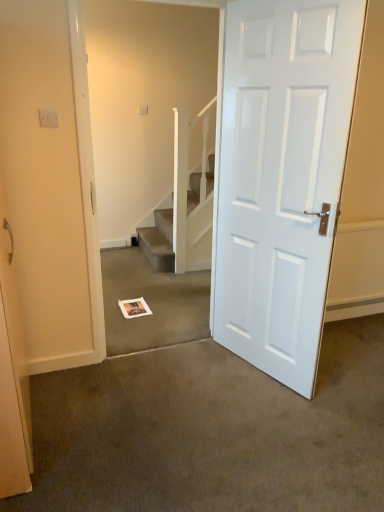
The height and width of the screenshot is (512, 384). Describe the element at coordinates (282, 177) in the screenshot. I see `white glossy door at right` at that location.

You are a GUI agent. You are given a task and a screenshot of the screen. Output one action in this format:
    pyautogui.click(x=<x>, y=<y>)
    Task: Click on the white glossy door at right
    
    Given the screenshot: What is the action you would take?
    pyautogui.click(x=282, y=177)

The width and height of the screenshot is (384, 512). What are the coordinates of `white glossy door at right` in the screenshot? It's located at (282, 177).